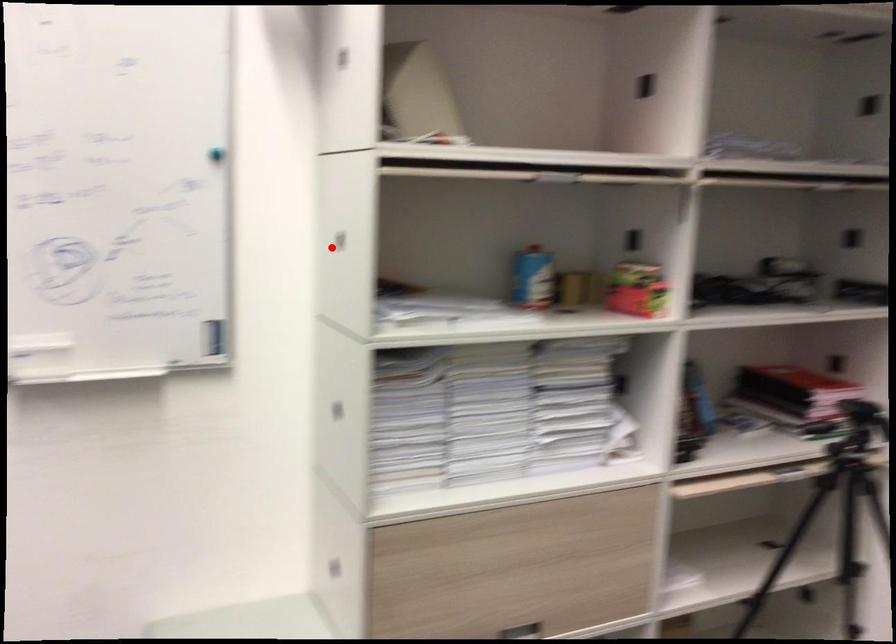
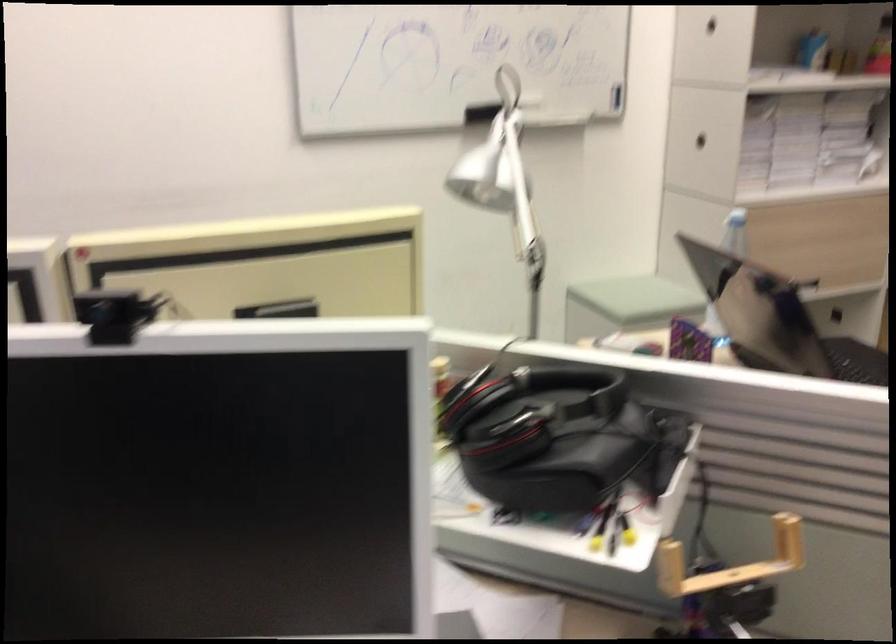
Question: A red point is marked in image1. In image2, is the corresponding 3D point closer to the camera or farther? Reply with the corresponding letter.

Choices:
 (A) The corresponding 3D point is closer.
 (B) The corresponding 3D point is farther.

Answer: (B)